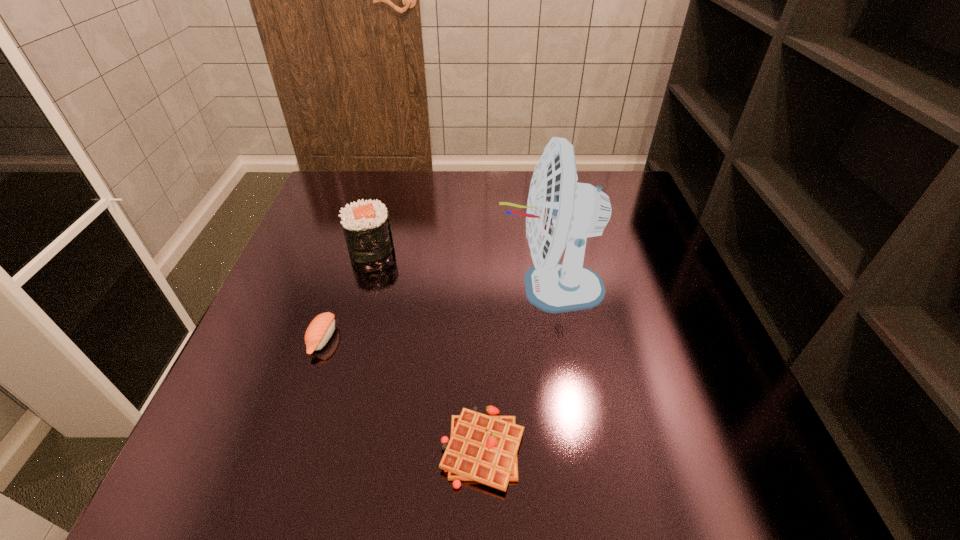
Find the location of a particular element. The image size is (960, 540). free space that is in between the fan and the waffle is located at coordinates (516, 368).

I want to click on free space between the nearest object and the nearer sushi, so click(x=402, y=394).

Image resolution: width=960 pixels, height=540 pixels. Identify the location of empty space between the taller sushi and the shortest object. (427, 348).

The height and width of the screenshot is (540, 960). Find the location of `free space between the tallest object and the nearer sushi`. free space between the tallest object and the nearer sushi is located at coordinates (436, 313).

You are a GUI agent. You are given a task and a screenshot of the screen. Output one action in this format:
    pyautogui.click(x=<x>, y=<y>)
    Task: Click on the free space between the nearest object and the shorter sushi
    
    Given the screenshot: What is the action you would take?
    pyautogui.click(x=402, y=394)

Where is `vacant space in between the nearer sushi and the fan`? vacant space in between the nearer sushi and the fan is located at coordinates (436, 313).

This screenshot has width=960, height=540. I want to click on blank region between the waffle and the fan, so click(516, 368).

Identify the location of free point between the tallest object and the second shortest object. (436, 313).

Where is `free space between the waffle and the tallest object`? The height and width of the screenshot is (540, 960). free space between the waffle and the tallest object is located at coordinates (516, 368).

Identify the location of object that is the closest to the nearer sushi. (366, 226).